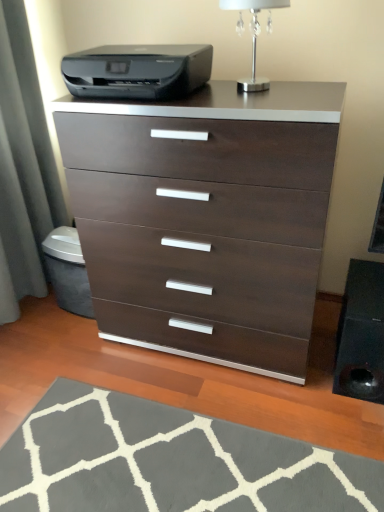
The width and height of the screenshot is (384, 512). In order to click on black plastic printer at upper center in this screenshot , I will do `click(137, 71)`.

This screenshot has height=512, width=384. What do you see at coordinates (253, 35) in the screenshot?
I see `silver metallic table lamp at upper center` at bounding box center [253, 35].

Describe the element at coordinates (206, 218) in the screenshot. The width and height of the screenshot is (384, 512). I see `dark wood/finish chest of drawers at center` at that location.

This screenshot has width=384, height=512. Identify the location of black plastic printer at upper center. (137, 71).

Could you tell me if gray soft rug at lower center is turned towards silver metallic table lamp at upper center?

No, gray soft rug at lower center is not aimed at silver metallic table lamp at upper center.

Considering the sizes of gray soft rug at lower center and silver metallic table lamp at upper center in the image, is gray soft rug at lower center bigger or smaller than silver metallic table lamp at upper center?

gray soft rug at lower center is bigger than silver metallic table lamp at upper center.

How many degrees apart are the facing directions of gray soft rug at lower center and silver metallic table lamp at upper center?

86.5 degrees.

In the scene shown: Considering the sizes of objects gray soft rug at lower center and silver metallic table lamp at upper center in the image provided, who is shorter, gray soft rug at lower center or silver metallic table lamp at upper center?

gray soft rug at lower center is shorter.

Considering the sizes of objects gray soft rug at lower center and dark wood/finish chest of drawers at center in the image provided, who is wider, gray soft rug at lower center or dark wood/finish chest of drawers at center?

gray soft rug at lower center is wider.

Which object is further away from the camera, gray soft rug at lower center or dark wood/finish chest of drawers at center?

Positioned behind is dark wood/finish chest of drawers at center.

Can you confirm if gray soft rug at lower center is positioned to the left of dark wood/finish chest of drawers at center?

Correct, you'll find gray soft rug at lower center to the left of dark wood/finish chest of drawers at center.

From the image's perspective, which is below, gray soft rug at lower center or dark wood/finish chest of drawers at center?

From the image's view, gray soft rug at lower center is below.

Is gray soft rug at lower center wider or thinner than black plastic printer at upper center?

Considering their sizes, gray soft rug at lower center looks broader than black plastic printer at upper center.

Does gray soft rug at lower center have a greater height compared to black plastic printer at upper center?

No.

Is gray soft rug at lower center to the right of black plastic printer at upper center from the viewer's perspective?

Indeed, gray soft rug at lower center is positioned on the right side of black plastic printer at upper center.

Considering the points (100, 455) and (142, 55), which point is behind, point (100, 455) or point (142, 55)?

Positioned behind is point (100, 455).

Is silver metallic table lamp at upper center spatially inside dark wood/finish chest of drawers at center, or outside of it?

silver metallic table lamp at upper center is spatially situated outside dark wood/finish chest of drawers at center.

Can you see silver metallic table lamp at upper center touching dark wood/finish chest of drawers at center?

There is a gap between silver metallic table lamp at upper center and dark wood/finish chest of drawers at center.

Considering the sizes of objects silver metallic table lamp at upper center and dark wood/finish chest of drawers at center in the image provided, who is shorter, silver metallic table lamp at upper center or dark wood/finish chest of drawers at center?

silver metallic table lamp at upper center is shorter.

Does point (262, 4) appear closer or farther from the camera than point (256, 152)?

Clearly, point (262, 4) is more distant from the camera than point (256, 152).

From the image's perspective, which is above, silver metallic table lamp at upper center or gray soft rug at lower center?

From the image's view, silver metallic table lamp at upper center is above.

Is gray soft rug at lower center completely or partially inside silver metallic table lamp at upper center?

That's incorrect, gray soft rug at lower center is not inside silver metallic table lamp at upper center.

What's the angular difference between silver metallic table lamp at upper center and gray soft rug at lower center's facing directions?

86.5 degrees separate the facing orientations of silver metallic table lamp at upper center and gray soft rug at lower center.

Is silver metallic table lamp at upper center a part of black plastic printer at upper center?

No, silver metallic table lamp at upper center is not inside black plastic printer at upper center.

In the scene shown: Who is shorter, black plastic printer at upper center or silver metallic table lamp at upper center?

black plastic printer at upper center is shorter.

Between black plastic printer at upper center and dark wood/finish chest of drawers at center, which one is positioned in front?

Positioned in front is dark wood/finish chest of drawers at center.

Is black plastic printer at upper center positioned far away from dark wood/finish chest of drawers at center?

No, black plastic printer at upper center is not far away from dark wood/finish chest of drawers at center.

Is black plastic printer at upper center not within dark wood/finish chest of drawers at center?

That's correct, black plastic printer at upper center is outside of dark wood/finish chest of drawers at center.

Can you tell me how much black plastic printer at upper center and dark wood/finish chest of drawers at center differ in facing direction?

The angular difference between black plastic printer at upper center and dark wood/finish chest of drawers at center is 0.0107 degrees.

The image size is (384, 512). I want to click on doormat lying below the silver metallic table lamp at upper center (from the image's perspective), so click(x=169, y=461).

The width and height of the screenshot is (384, 512). I want to click on the chest of drawers lying behind the gray soft rug at lower center, so click(x=206, y=218).

Based on their spatial positions, is silver metallic table lamp at upper center or dark wood/finish chest of drawers at center closer to gray soft rug at lower center?

dark wood/finish chest of drawers at center.

Considering their positions, is silver metallic table lamp at upper center positioned closer to gray soft rug at lower center than black plastic printer at upper center?

black plastic printer at upper center.

Looking at the image, which one is located further to silver metallic table lamp at upper center, black plastic printer at upper center or gray soft rug at lower center?

gray soft rug at lower center.

From the image, which object appears to be farther from gray soft rug at lower center, dark wood/finish chest of drawers at center or black plastic printer at upper center?

Among the two, black plastic printer at upper center is located further to gray soft rug at lower center.

Which object lies nearer to the anchor point black plastic printer at upper center, gray soft rug at lower center or dark wood/finish chest of drawers at center?

The object closer to black plastic printer at upper center is dark wood/finish chest of drawers at center.

From the image, which object appears to be nearer to dark wood/finish chest of drawers at center, silver metallic table lamp at upper center or black plastic printer at upper center?

black plastic printer at upper center.

Considering their positions, is silver metallic table lamp at upper center positioned closer to black plastic printer at upper center than gray soft rug at lower center?

silver metallic table lamp at upper center.

Estimate the real-world distances between objects in this image. Which object is further from silver metallic table lamp at upper center, gray soft rug at lower center or black plastic printer at upper center?

gray soft rug at lower center is further to silver metallic table lamp at upper center.

Find the location of a particular element. The width and height of the screenshot is (384, 512). printer between silver metallic table lamp at upper center and gray soft rug at lower center in the up-down direction is located at coordinates click(137, 71).

Image resolution: width=384 pixels, height=512 pixels. In order to click on printer between silver metallic table lamp at upper center and dark wood/finish chest of drawers at center from top to bottom in this screenshot , I will do `click(137, 71)`.

The height and width of the screenshot is (512, 384). Find the location of `chest of drawers between silver metallic table lamp at upper center and gray soft rug at lower center in the up-down direction`. chest of drawers between silver metallic table lamp at upper center and gray soft rug at lower center in the up-down direction is located at coordinates (206, 218).

Where is `chest of drawers between black plastic printer at upper center and gray soft rug at lower center from top to bottom`? chest of drawers between black plastic printer at upper center and gray soft rug at lower center from top to bottom is located at coordinates (206, 218).